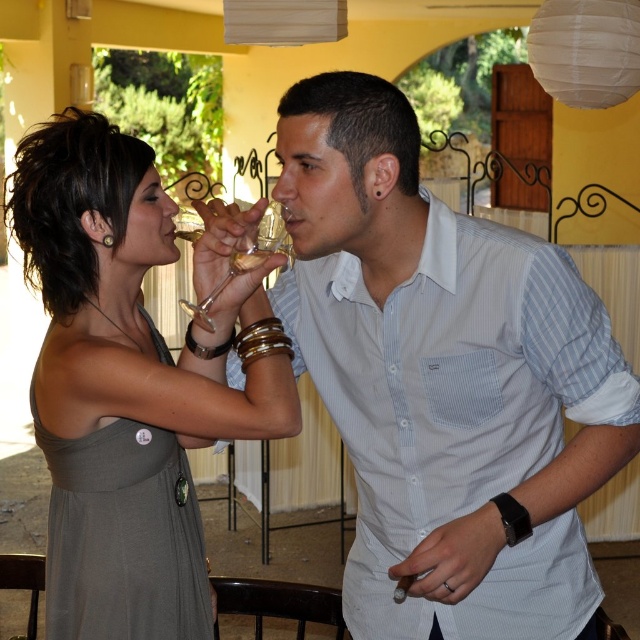
You are a photographer trying to capture the perfect shot of the matte gray dress at center and the transparent glass wine glass at center. Since you want both objects to appear equally prominent in the photo, which one should you zoom in on more?

The matte gray dress at center is larger in size than the transparent glass wine glass at center, so you should zoom in more on the transparent glass wine glass at center to balance their prominence in the photo.

You are a photographer capturing this scene. You notice the translucent glass at upper center and the clear glass wine at upper center. Which object is located to the right of the other?

The translucent glass at upper center is positioned on the right side of clear glass wine at upper center.